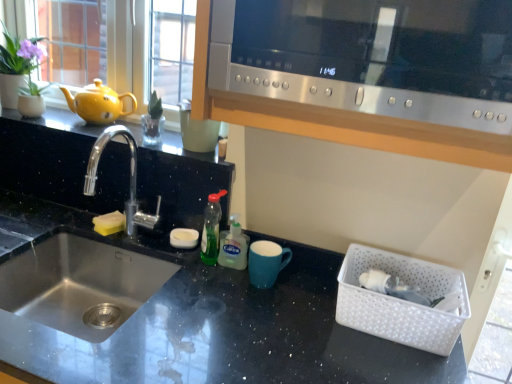
I want to click on free spot to the left of green translucent soap dispenser at center, which appears as the 2th bottle when viewed from the left, so click(181, 259).